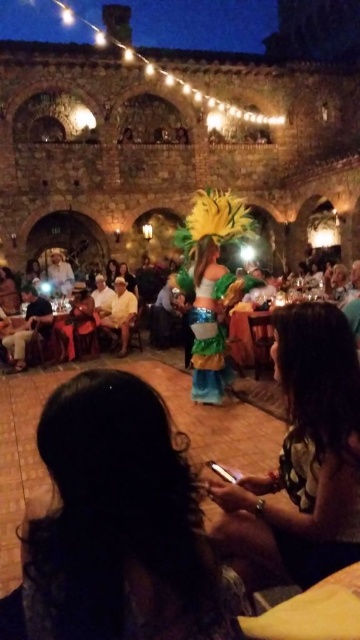
Is shiny metallic phone at lower right to the right of wooden table at center from the viewer's perspective?

No, shiny metallic phone at lower right is not to the right of wooden table at center.

Who is more forward, (291, 310) or (245, 346)?

Point (291, 310) is more forward.

Is point (304, 476) closer to viewer compared to point (250, 330)?

Yes, it is in front of point (250, 330).

Identify the location of shiny metallic phone at lower right. (303, 456).

Can you confirm if shiny metallic phone at lower right is taller than light brown leather jacket at lower left?

Yes, shiny metallic phone at lower right is taller than light brown leather jacket at lower left.

Who is positioned more to the left, shiny metallic phone at lower right or light brown leather jacket at lower left?

light brown leather jacket at lower left

What do you see at coordinates (303, 456) in the screenshot? The image size is (360, 640). I see `shiny metallic phone at lower right` at bounding box center [303, 456].

Where is `shiny metallic phone at lower right`? shiny metallic phone at lower right is located at coordinates (303, 456).

Does wooden table at center have a greater width compared to light brown leather jacket at lower left?

Yes, wooden table at center is wider than light brown leather jacket at lower left.

Does wooden table at center have a lesser width compared to light brown leather jacket at lower left?

No, wooden table at center is not thinner than light brown leather jacket at lower left.

Identify the location of wooden table at center. This screenshot has width=360, height=640. (254, 336).

Where is `wooden table at center`? wooden table at center is located at coordinates (254, 336).